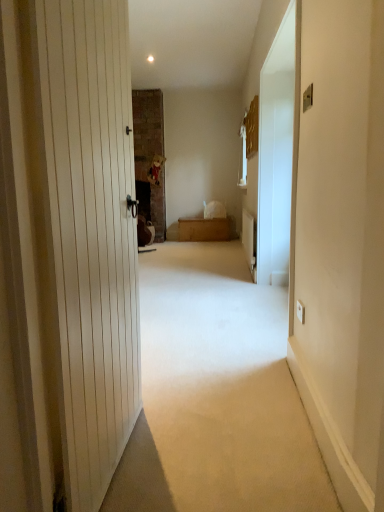
Where is `free space to the left of white glossy screen door at right`? The height and width of the screenshot is (512, 384). free space to the left of white glossy screen door at right is located at coordinates (203, 310).